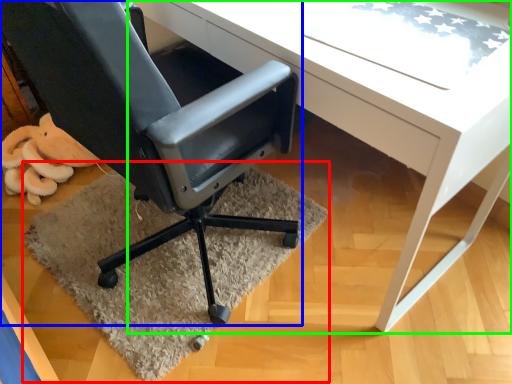
Question: Considering the real-world distances, which object is farthest from mat (highlighted by a red box)? chair (highlighted by a blue box) or desk (highlighted by a green box)?

Choices:
 (A) chair
 (B) desk

Answer: (B)